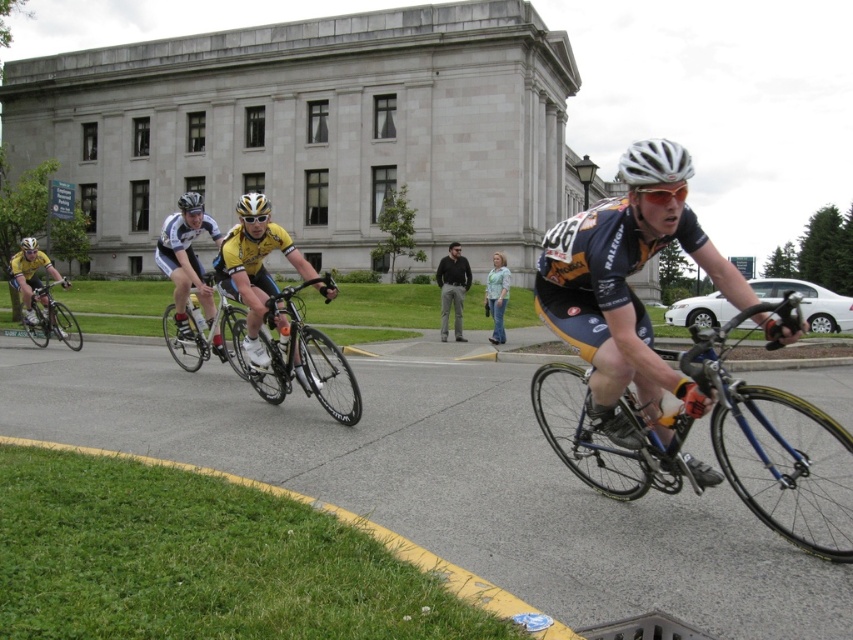
Question: Which of the following is the closest to the observer?

Choices:
 (A) (495, 301)
 (B) (190, 192)

Answer: (A)

Question: Can you confirm if blue metallic bicycle at center is smaller than yellow jersey cyclist at center?

Choices:
 (A) no
 (B) yes

Answer: (B)

Question: Is blue metallic bicycle at center in front of shiny silver helmet at center?

Choices:
 (A) no
 (B) yes

Answer: (B)

Question: Can you confirm if black smooth pants at center is positioned below shiny silver helmet at center?

Choices:
 (A) yes
 (B) no

Answer: (A)

Question: Considering the real-world distances, which object is closest to the light green fabric shirt at lower center?

Choices:
 (A) shiny silver helmet at center
 (B) shiny silver bicycle at center

Answer: (B)

Question: Which object is farther from the camera taking this photo?

Choices:
 (A) shiny silver helmet at upper left
 (B) black smooth pants at center
 (C) matte blue jersey at center

Answer: (B)